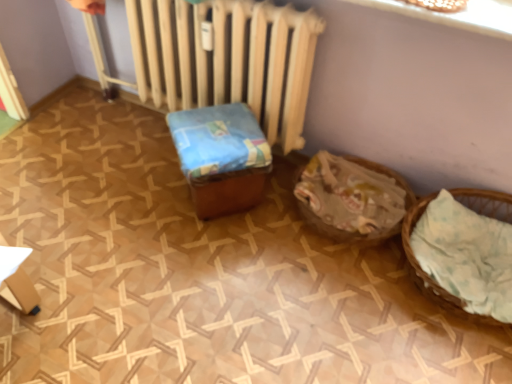
Identify the location of vacant area that lies between blue fabric-covered box at center and white matte radiator at center. This screenshot has width=512, height=384. (158, 159).